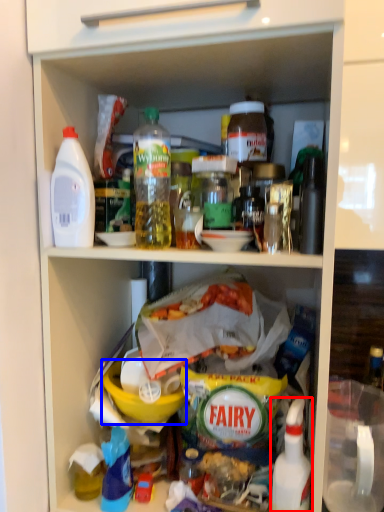
Question: Which object is closer to the camera taking this photo, bottle (highlighted by a red box) or bowl (highlighted by a blue box)?

Choices:
 (A) bottle
 (B) bowl

Answer: (A)